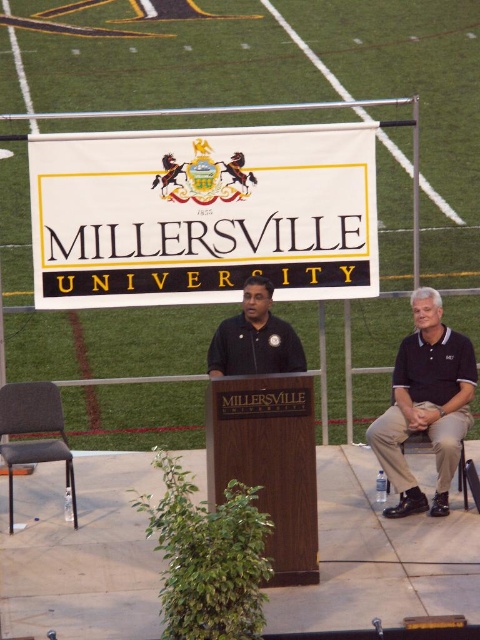
You are organizing a campus event and need to place a new banner between the white fabric sign at center and the tan fabric chair at lower right. Given that the banner is 1.5 meters wide, can you determine if there is enough space between them to fit the banner?

The white fabric sign at center is larger than the tan fabric chair at lower right, but the description does not provide specific distance information between them. Therefore, it is impossible to determine if the 1.5 meter wide banner can fit between them based on the given details.

You are attending an event at Millersville University and notice two individuals on stage. The first is wearing a dark blue polo shirt at right, and the second is wearing a black smooth shirt at center. Which person is wearing a larger shirt?

The dark blue polo shirt at right is larger in size than the black smooth shirt at center, so the person wearing the dark blue polo shirt at right has the larger shirt.

Looking at this image, you are organizing an event and need to place a 1.5 meter wide table between the white fabric sign at center and the tan fabric chair at lower right. Can the table fit between them based on their widths?

The white fabric sign at center is wider than the tan fabric chair at lower right. However, the question is about placing a table between them, which depends on the distance between the two objects, not their widths. The provided information only states the relative widths of the objects, not the space between them. Therefore, it is impossible to determine if the 1.5 meter wide table can fit based on the given data.